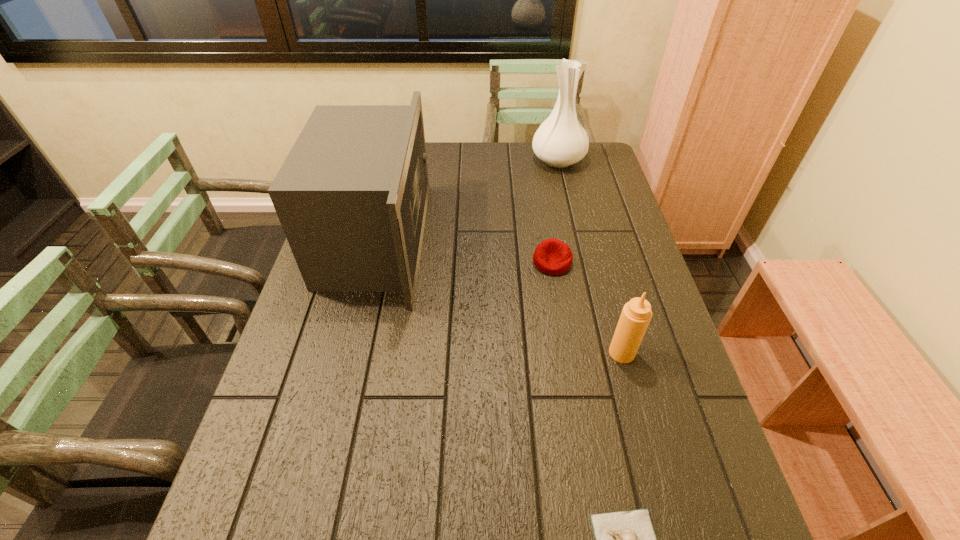
Find the location of a particular element. This screenshot has width=960, height=540. free spot between the vase and the microwave oven is located at coordinates (468, 200).

The width and height of the screenshot is (960, 540). What are the coordinates of `free space between the vase and the beanbag` in the screenshot? It's located at (555, 211).

Identify the location of object that is the fourth closest one to the microwave oven. This screenshot has width=960, height=540. (626, 539).

Image resolution: width=960 pixels, height=540 pixels. Identify the location of the second closest object to the third tallest object. (626, 539).

Where is `vacant space that satisfies the following two spatial constraints: 1. on the seat area of the fourth farthest object; 2. on the right side of the fourth tallest object`? vacant space that satisfies the following two spatial constraints: 1. on the seat area of the fourth farthest object; 2. on the right side of the fourth tallest object is located at coordinates (566, 353).

The image size is (960, 540). What are the coordinates of `free location that satisfies the following two spatial constraints: 1. on the seat area of the beanbag; 2. on the left side of the condiment` in the screenshot? It's located at (566, 353).

I want to click on free spot that satisfies the following two spatial constraints: 1. on the front side of the farthest object; 2. on the front-facing side of the microwave oven, so click(x=577, y=240).